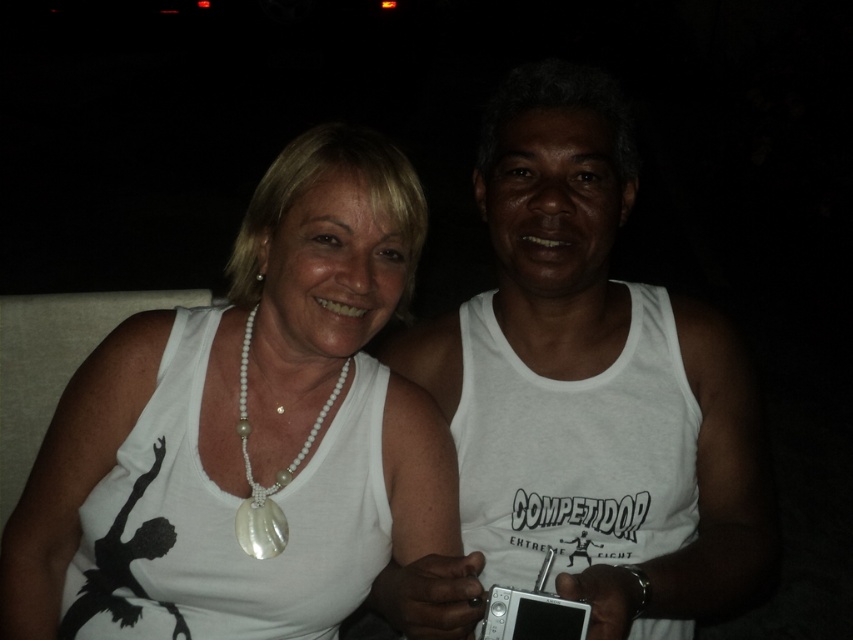
Is white pearl necklace at upper left positioned in front of pearl/shell necklace at center?

Yes.

Does white pearl necklace at upper left have a lesser width compared to pearl/shell necklace at center?

No.

Image resolution: width=853 pixels, height=640 pixels. I want to click on white pearl necklace at upper left, so click(x=247, y=429).

Can you confirm if white matte tank top at right is smaller than pearl/shell necklace at center?

No.

Which is in front, point (390, 577) or point (270, 520)?

Positioned in front is point (390, 577).

What do you see at coordinates (583, 396) in the screenshot? I see `white matte tank top at right` at bounding box center [583, 396].

Find the location of `white matte tank top at right`. white matte tank top at right is located at coordinates (583, 396).

Can you confirm if white pearl necklace at upper left is positioned above white matte tank top at right?

Actually, white pearl necklace at upper left is below white matte tank top at right.

Which is in front, point (257, 244) or point (618, 396)?

Point (257, 244)

Find the location of a particular element. This screenshot has height=640, width=853. white pearl necklace at upper left is located at coordinates (247, 429).